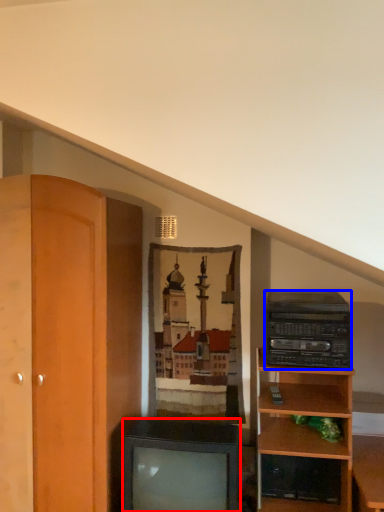
Question: Which object is closer to the camera taking this photo, television (highlighted by a red box) or stereo (highlighted by a blue box)?

Choices:
 (A) television
 (B) stereo

Answer: (A)